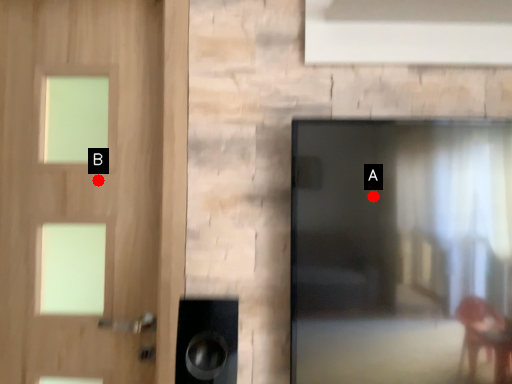
Question: Two points are circled on the image, labeled by A and B beside each circle. Which point appears closest to the camera in this image?

Choices:
 (A) A is closer
 (B) B is closer

Answer: (A)